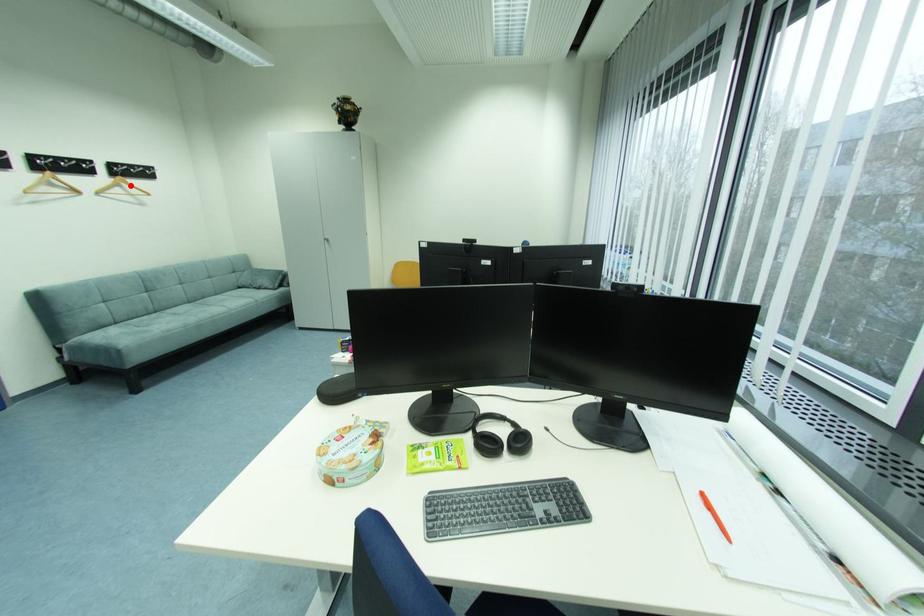
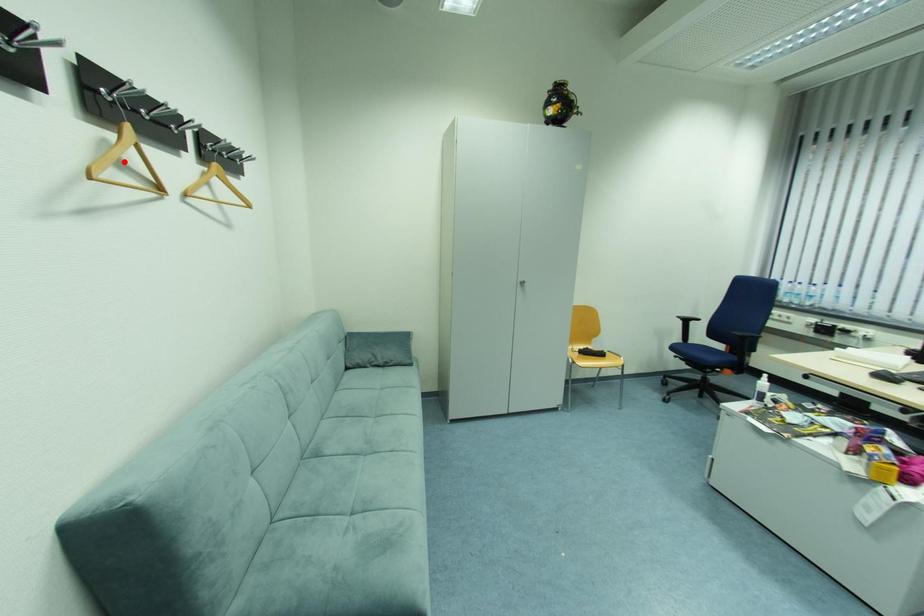
I am providing you with two images of the same scene from different viewpoints. A red point is marked on the first image and another point is marked on the second image. Is the red point in image1 aligned with the point shown in image2?

No